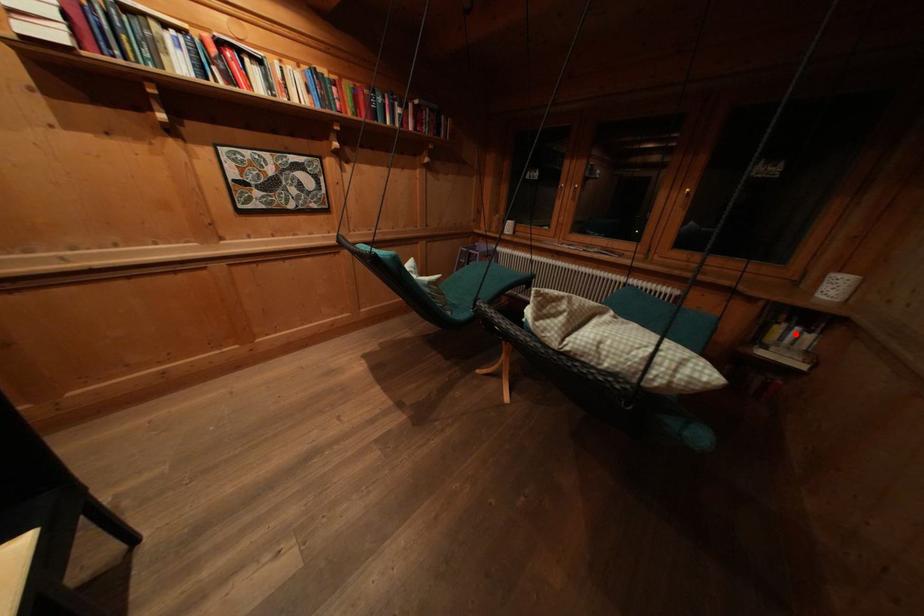
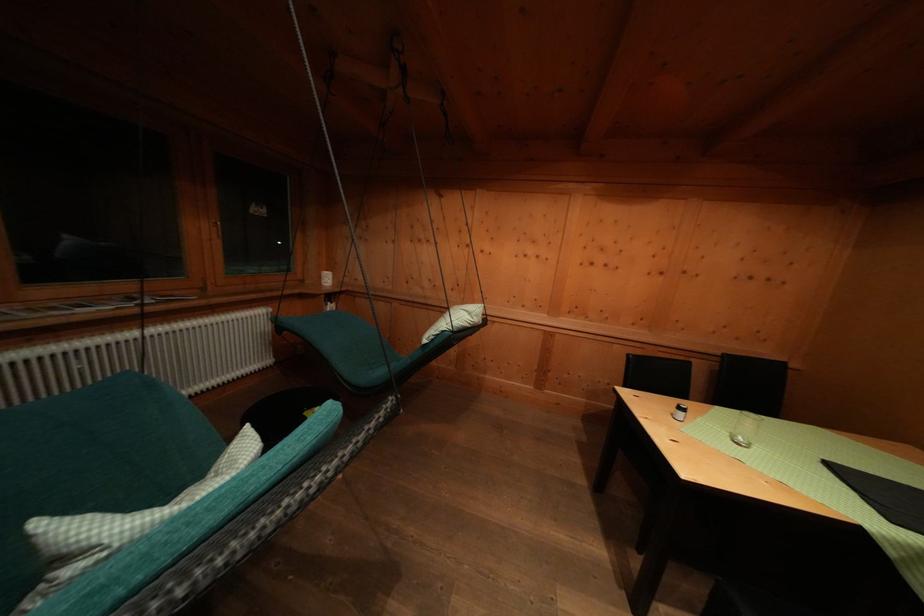
In the second image, find the point that corresponds to the highlighted location in the first image.

(333, 310)